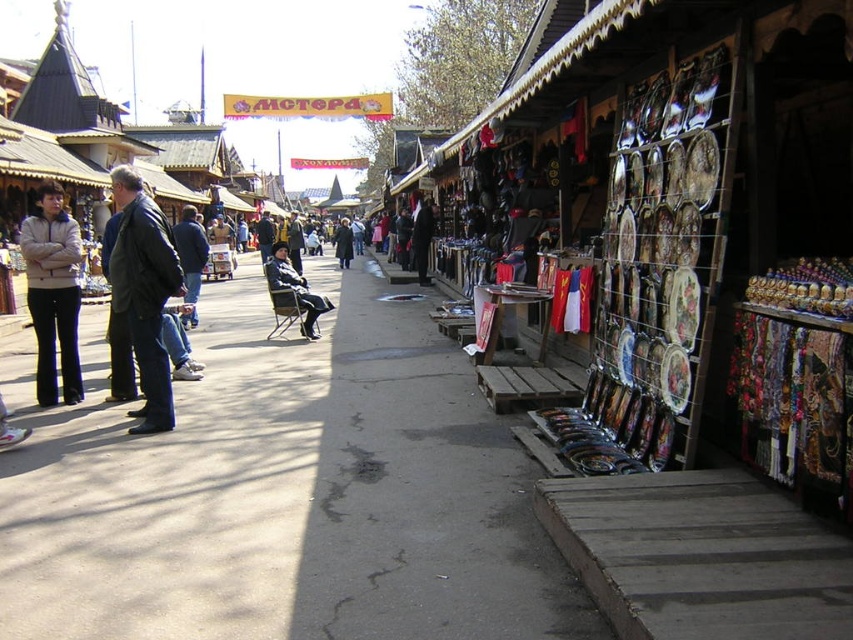
You are a delivery person carrying a heavy box and need to place it on the dark gray fabric chair at center. The box is 12 feet long. Is the concrete sidewalk at center between you and the chair, and is there enough space to maneuver the box onto the chair?

The concrete sidewalk at center is 10.69 feet from the dark gray fabric chair at center. Since the box is 12 feet long, the distance between them is insufficient to maneuver the box onto the chair. Additionally, the concrete sidewalk at center is located between you and the chair, so you might need to find another path or a closer location to place the box.

You are a delivery person carrying a large box that is 1 meter wide. You need to walk through the market and pass between the concrete sidewalk at center and the dark green coat at center. Can your box fit through the space between them?

The concrete sidewalk at center is wider than the dark green coat at center, so the space between them may be sufficient for a 1 meter wide box. However, since the exact width isn

You are a tourist walking through the market and spot a dark green coat at center and a concrete sidewalk at center. Which object is positioned to the right of the other?

The concrete sidewalk at center is to the right of the dark green coat at center.